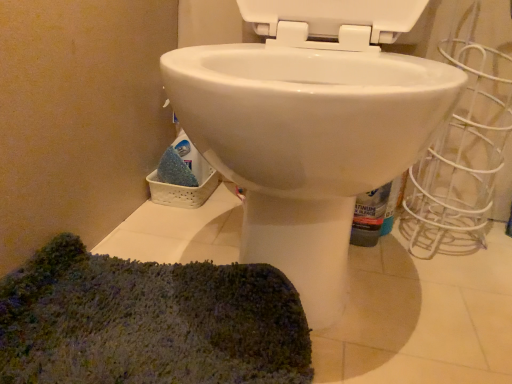
This screenshot has height=384, width=512. Identify the location of textured woolen bath mat at lower left. (148, 322).

This screenshot has height=384, width=512. Describe the element at coordinates (148, 322) in the screenshot. I see `textured woolen bath mat at lower left` at that location.

This screenshot has width=512, height=384. Find the location of `textured woolen bath mat at lower left`. textured woolen bath mat at lower left is located at coordinates tap(148, 322).